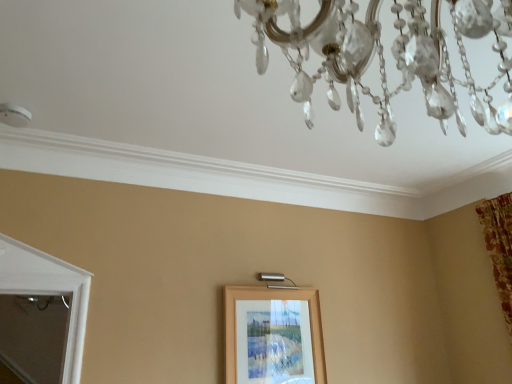
Identify the location of wooden picture frame at center. The height and width of the screenshot is (384, 512). (273, 335).

What do you see at coordinates (273, 335) in the screenshot?
I see `wooden picture frame at center` at bounding box center [273, 335].

Measure the distance between wooden picture frame at center and camera.

The distance of wooden picture frame at center from camera is 7.64 feet.

This screenshot has height=384, width=512. Find the location of `clear crystal chandelier at upper center`. clear crystal chandelier at upper center is located at coordinates (383, 57).

What do you see at coordinates (383, 57) in the screenshot? I see `clear crystal chandelier at upper center` at bounding box center [383, 57].

The image size is (512, 384). In order to click on wooden picture frame at center in this screenshot , I will do `click(273, 335)`.

Is clear crystal chandelier at upper center to the right of wooden picture frame at center from the viewer's perspective?

Yes.

Considering the positions of objects clear crystal chandelier at upper center and wooden picture frame at center in the image provided, who is behind, clear crystal chandelier at upper center or wooden picture frame at center?

wooden picture frame at center is more distant.

Is point (467, 5) closer to camera compared to point (276, 305)?

Yes.

From the image's perspective, which one is positioned higher, clear crystal chandelier at upper center or wooden picture frame at center?

From the image's view, clear crystal chandelier at upper center is above.

From a real-world perspective, which object rests below the other?

wooden picture frame at center, from a real-world perspective.

Considering the relative sizes of clear crystal chandelier at upper center and wooden picture frame at center in the image provided, is clear crystal chandelier at upper center thinner than wooden picture frame at center?

In fact, clear crystal chandelier at upper center might be wider than wooden picture frame at center.

From their relative heights in the image, would you say clear crystal chandelier at upper center is taller or shorter than wooden picture frame at center?

Clearly, clear crystal chandelier at upper center is shorter compared to wooden picture frame at center.

Considering the sizes of objects clear crystal chandelier at upper center and wooden picture frame at center in the image provided, who is bigger, clear crystal chandelier at upper center or wooden picture frame at center?

clear crystal chandelier at upper center.

From the picture: Is wooden picture frame at center inside clear crystal chandelier at upper center?

No, clear crystal chandelier at upper center does not contain wooden picture frame at center.

Would you say clear crystal chandelier at upper center is a long distance from wooden picture frame at center?

That's right, there is a large distance between clear crystal chandelier at upper center and wooden picture frame at center.

Is clear crystal chandelier at upper center oriented towards wooden picture frame at center?

Yes, clear crystal chandelier at upper center is aimed at wooden picture frame at center.

Identify the location of picture frame lying on the left of clear crystal chandelier at upper center. This screenshot has width=512, height=384. (273, 335).

Is wooden picture frame at center to the left of clear crystal chandelier at upper center from the viewer's perspective?

Indeed, wooden picture frame at center is positioned on the left side of clear crystal chandelier at upper center.

Considering their positions, is wooden picture frame at center located in front of or behind clear crystal chandelier at upper center?

wooden picture frame at center is positioned farther from the viewer than clear crystal chandelier at upper center.

Which is behind, point (236, 296) or point (373, 37)?

Point (236, 296)

From the image's perspective, which one is positioned lower, wooden picture frame at center or clear crystal chandelier at upper center?

wooden picture frame at center.

Looking at this image, from a real-world perspective, between wooden picture frame at center and clear crystal chandelier at upper center, who is vertically higher?

clear crystal chandelier at upper center.

Which object is wider, wooden picture frame at center or clear crystal chandelier at upper center?

Wider between the two is clear crystal chandelier at upper center.

Can you confirm if wooden picture frame at center is shorter than clear crystal chandelier at upper center?

No, wooden picture frame at center is not shorter than clear crystal chandelier at upper center.

Considering the relative sizes of wooden picture frame at center and clear crystal chandelier at upper center in the image provided, is wooden picture frame at center bigger than clear crystal chandelier at upper center?

Incorrect, wooden picture frame at center is not larger than clear crystal chandelier at upper center.

Is wooden picture frame at center not inside clear crystal chandelier at upper center?

Absolutely, wooden picture frame at center is external to clear crystal chandelier at upper center.

Is wooden picture frame at center directly adjacent to clear crystal chandelier at upper center?

wooden picture frame at center and clear crystal chandelier at upper center are clearly separated.

Is wooden picture frame at center looking in the opposite direction of clear crystal chandelier at upper center?

No, wooden picture frame at center's orientation is not away from clear crystal chandelier at upper center.

What's the angular difference between wooden picture frame at center and clear crystal chandelier at upper center's facing directions?

176 degrees.

Where is `picture frame on the left side of clear crystal chandelier at upper center`? This screenshot has height=384, width=512. picture frame on the left side of clear crystal chandelier at upper center is located at coordinates (273, 335).

Locate an element on the screen. The height and width of the screenshot is (384, 512). picture frame below the clear crystal chandelier at upper center (from a real-world perspective) is located at coordinates (273, 335).

Find the location of a particular element. chandelier on the right of wooden picture frame at center is located at coordinates (383, 57).